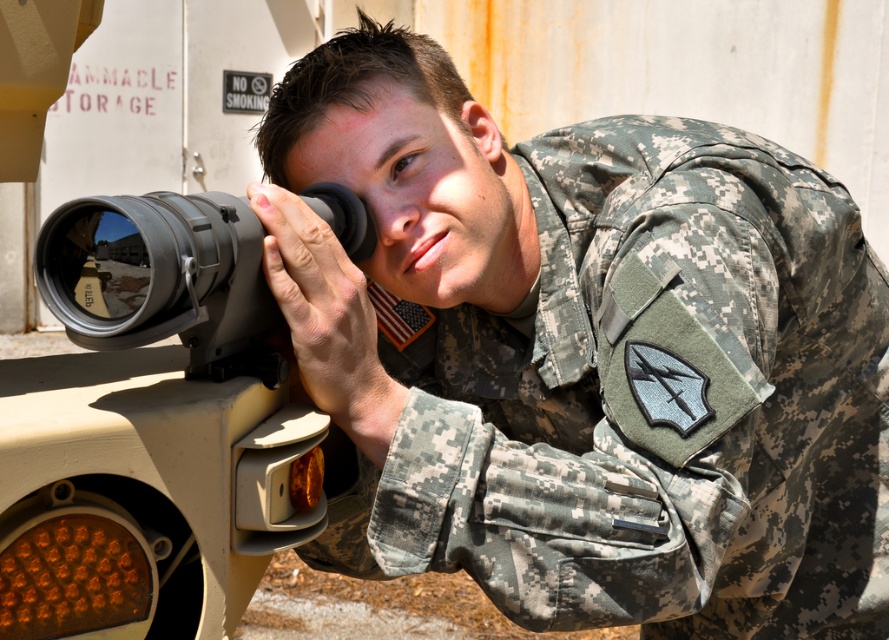
Question: Can you confirm if camouflage uniform at center is positioned above matte black scope at center?

Choices:
 (A) no
 (B) yes

Answer: (A)

Question: Which of the following is the closest to the observer?

Choices:
 (A) matte black scope at center
 (B) camouflage uniform at center

Answer: (A)

Question: Is camouflage uniform at center in front of matte black scope at center?

Choices:
 (A) no
 (B) yes

Answer: (A)

Question: Is camouflage uniform at center in front of matte black scope at center?

Choices:
 (A) no
 (B) yes

Answer: (A)